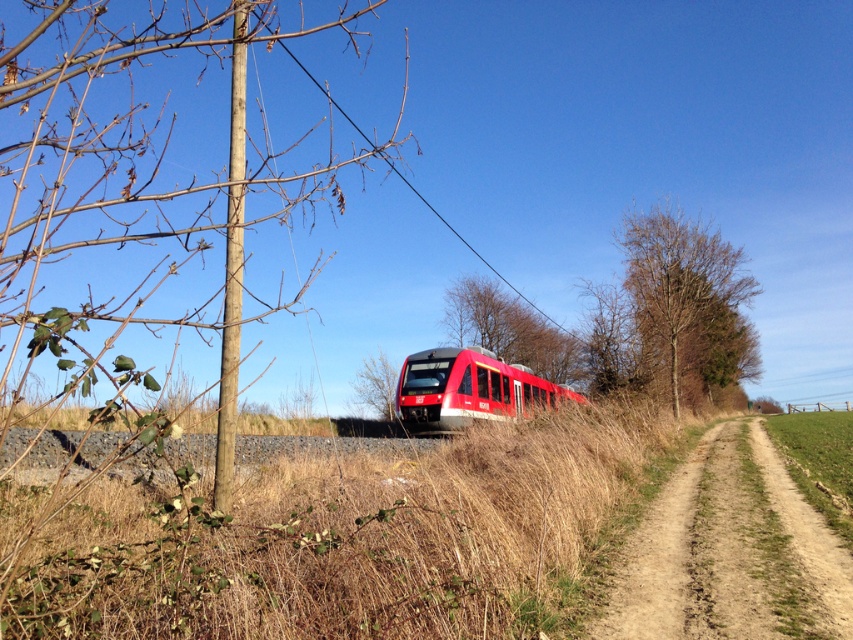
You are a photographer standing in the middle of the railway track. You want to take a photo of the dry grass at center and the brown leafless tree at center. Which object will appear closer to the camera in the photo?

The dry grass at center will appear closer to the camera in the photo because it is positioned in front of the brown leafless tree at center.

You are a photographer trying to capture the entire scene of the red train in the image. You notice the brown sandy dirt track at lower right and the smooth bark tree at center. Which object would you need to frame more carefully to ensure it doesn,t get cut off?

The brown sandy dirt track at lower right has a lesser width compared to the smooth bark tree at center, so you need to frame the brown sandy dirt track at lower right more carefully to ensure it doesn,t get cut off due to its narrower size.

You are a photographer standing at the center of the scene. You want to take a photo that includes both the dry grass at center and the brown leafless tree at center. Given that your camera has a maximum focus range of 40 meters, will you be able to capture both objects in focus without moving?

The dry grass at center is 38.26 meters away from the brown leafless tree at center. Since the distance between them is within the camera maximum focus range of 40 meters, you can capture both objects in focus without moving.